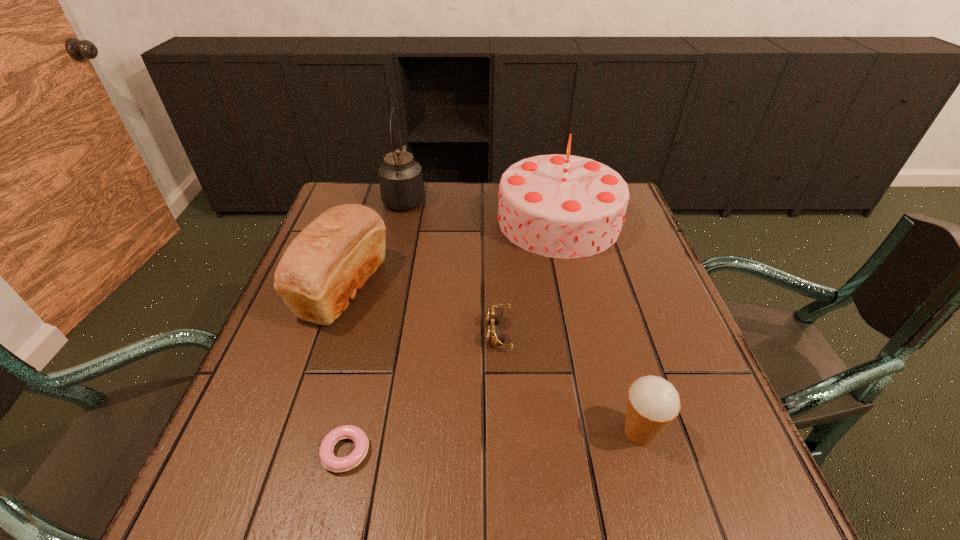
The height and width of the screenshot is (540, 960). Find the location of `object located at the far left corner`. object located at the far left corner is located at coordinates (401, 180).

I want to click on object that is at the far right corner, so click(x=562, y=206).

Find the location of a particular element. This screenshot has width=960, height=540. free space at the far edge of the desktop is located at coordinates (398, 226).

The image size is (960, 540). I want to click on vacant space at the near edge, so click(x=550, y=486).

This screenshot has width=960, height=540. In order to click on vacant region at the left edge in this screenshot , I will do `click(275, 433)`.

Where is `vacant space at the right edge of the desktop`? The width and height of the screenshot is (960, 540). vacant space at the right edge of the desktop is located at coordinates (712, 386).

Image resolution: width=960 pixels, height=540 pixels. Identify the location of free space at the near left corner of the desktop. pyautogui.click(x=237, y=514).

Locate an element on the screen. vacant space at the far right corner of the desktop is located at coordinates (630, 204).

Where is `free spot between the bread and the shortest object`? This screenshot has height=540, width=960. free spot between the bread and the shortest object is located at coordinates (345, 369).

Where is `free space that is in between the fourth shortest object and the birthday cake`? This screenshot has width=960, height=540. free space that is in between the fourth shortest object and the birthday cake is located at coordinates pyautogui.click(x=451, y=254).